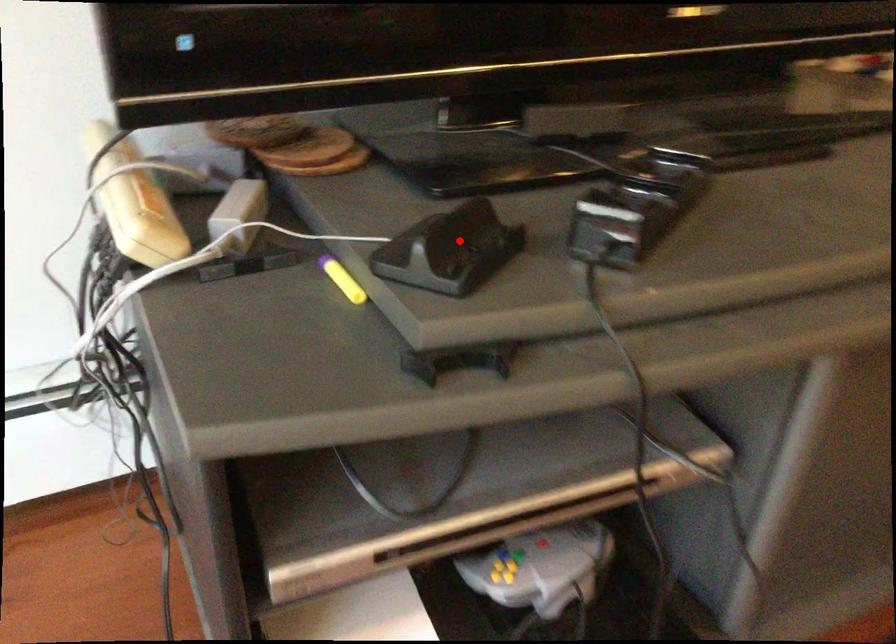
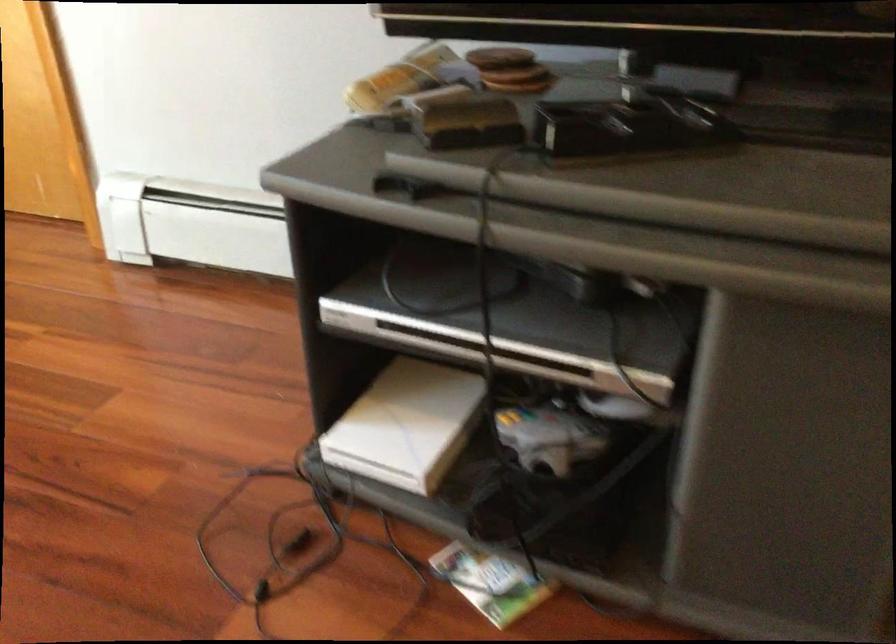
In the second image, find the point that corresponds to the highlighted location in the first image.

(469, 124)